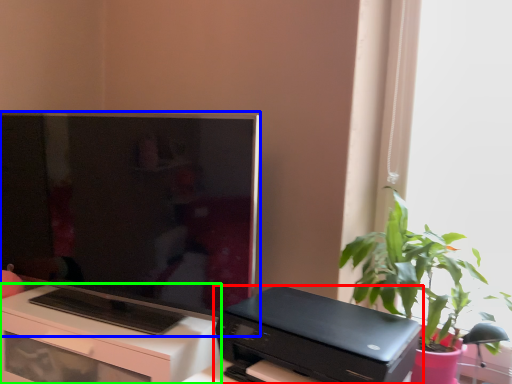
Question: Which object is the farthest from printer (highlighted by a red box)? Choose among these: television (highlighted by a blue box) or desk (highlighted by a green box).

Choices:
 (A) television
 (B) desk

Answer: (A)